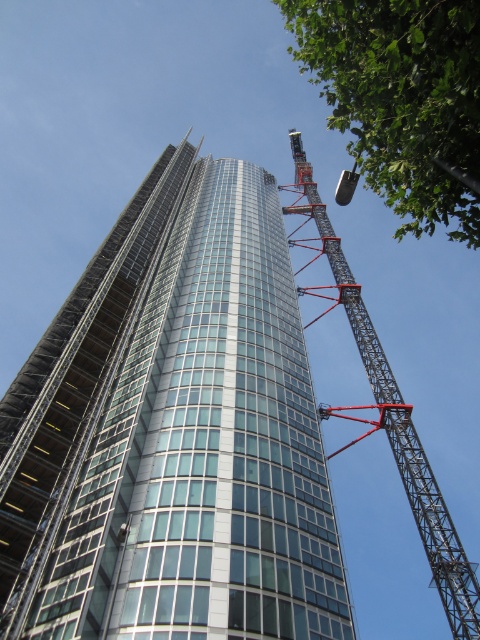
You are an inspector standing at the base of the skyscraper. You need to check both the metallic gray crane at right and the metallic gray crane at upper right. Which crane should you check first if you want to start with the one closer to the left side of the skyscraper?

You should check the metallic gray crane at right first because it is positioned to the left of the metallic gray crane at upper right, making it closer to the left side of the skyscraper.

You are a construction worker observing the glassy steel skyscraper at center and the metallic gray crane at right. Which object is shorter in height?

The glassy steel skyscraper at center is not as tall as the metallic gray crane at right, so it is shorter in height.

You are a construction worker standing at the base of the metallic gray crane at right. You need to move to the metallic gray crane at upper right to secure some equipment. Given that the distance between them is 151.09 feet, can you estimate how many minutes it would take you to walk directly between them at an average walking speed of 3 feet per second?

The distance between the metallic gray crane at right and the metallic gray crane at upper right is 151.09 feet. At an average walking speed of 3 feet per second, it would take approximately 50.36 seconds, which is roughly 0.84 minutes. Therefore, it would take about 1 minute to walk between them.